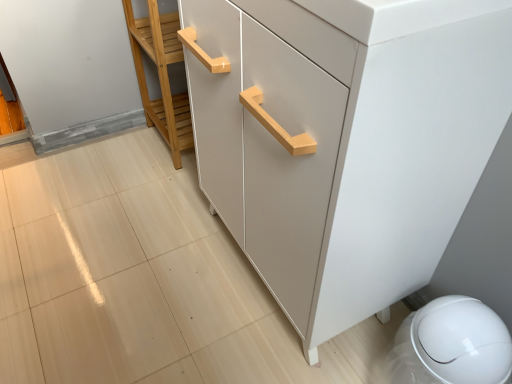
Question: Does matte white cabinet at center have a greater height compared to light wood cabinet handle at center?

Choices:
 (A) no
 (B) yes

Answer: (B)

Question: Considering the relative sizes of matte white cabinet at center and light wood cabinet handle at center in the image provided, is matte white cabinet at center shorter than light wood cabinet handle at center?

Choices:
 (A) no
 (B) yes

Answer: (A)

Question: Is matte white cabinet at center bigger than light wood cabinet handle at center?

Choices:
 (A) yes
 (B) no

Answer: (A)

Question: Are matte white cabinet at center and light wood cabinet handle at center far apart?

Choices:
 (A) no
 (B) yes

Answer: (A)

Question: Is the depth of matte white cabinet at center less than that of light wood cabinet handle at center?

Choices:
 (A) yes
 (B) no

Answer: (A)

Question: Is matte white cabinet at center oriented towards light wood cabinet handle at center?

Choices:
 (A) no
 (B) yes

Answer: (A)

Question: Can you confirm if light wood cabinet handle at center is positioned to the right of matte white cabinet at center?

Choices:
 (A) yes
 (B) no

Answer: (B)

Question: Is light wood cabinet handle at center placed right next to matte white cabinet at center?

Choices:
 (A) yes
 (B) no

Answer: (B)

Question: Does light wood cabinet handle at center appear on the left side of matte white cabinet at center?

Choices:
 (A) yes
 (B) no

Answer: (A)

Question: Is light wood cabinet handle at center further to the viewer compared to matte white cabinet at center?

Choices:
 (A) no
 (B) yes

Answer: (B)

Question: Can you confirm if light wood cabinet handle at center is smaller than matte white cabinet at center?

Choices:
 (A) yes
 (B) no

Answer: (A)

Question: From the image's perspective, is light wood cabinet handle at center under matte white cabinet at center?

Choices:
 (A) no
 (B) yes

Answer: (A)

Question: In terms of height, does light wood cabinet handle at center look taller or shorter compared to matte white cabinet at center?

Choices:
 (A) short
 (B) tall

Answer: (A)